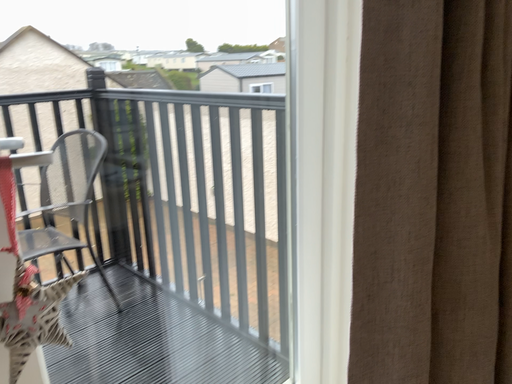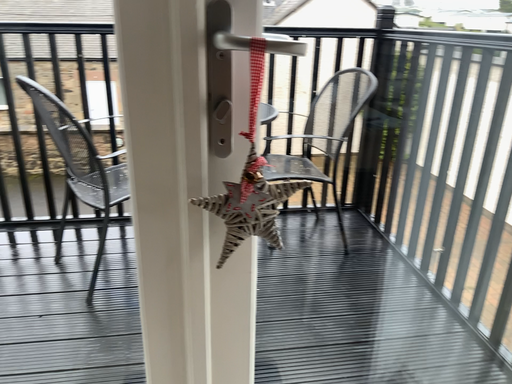
Question: How did the camera likely rotate when shooting the video?

Choices:
 (A) rotated right
 (B) rotated left

Answer: (B)